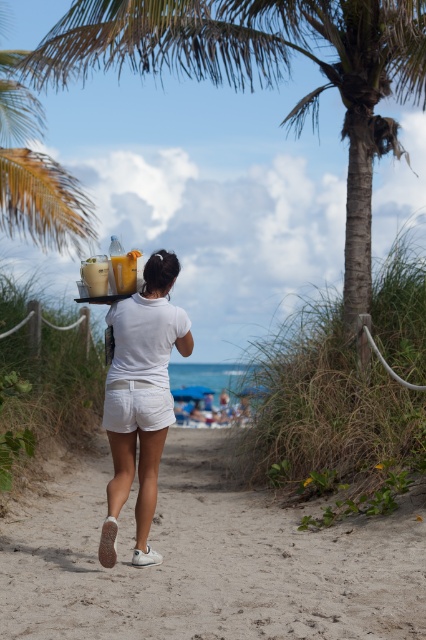
Question: Does green leafy palm tree at center appear under white matte shorts at center?

Choices:
 (A) yes
 (B) no

Answer: (B)

Question: Does white sandy beach at center lie in front of white matte shorts at center?

Choices:
 (A) yes
 (B) no

Answer: (B)

Question: Which of the following is the closest to the observer?

Choices:
 (A) dark brown hair at upper center
 (B) white sandy beach at center

Answer: (A)

Question: Does green leafy palm tree at center have a smaller size compared to white matte shorts at center?

Choices:
 (A) no
 (B) yes

Answer: (A)

Question: Which point is closer to the camera taking this photo?

Choices:
 (A) (161, 417)
 (B) (164, 330)
 (C) (166, 580)

Answer: (C)

Question: Which object is closer to the camera taking this photo?

Choices:
 (A) white cotton shorts at lower center
 (B) white sandy beach at center

Answer: (A)